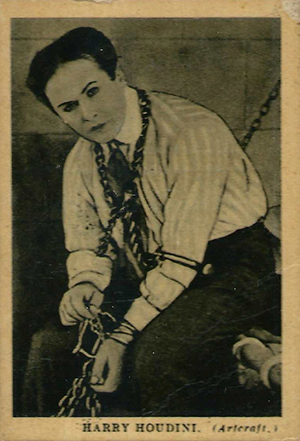
Find the location of a particular element. wall is located at coordinates (214, 60).